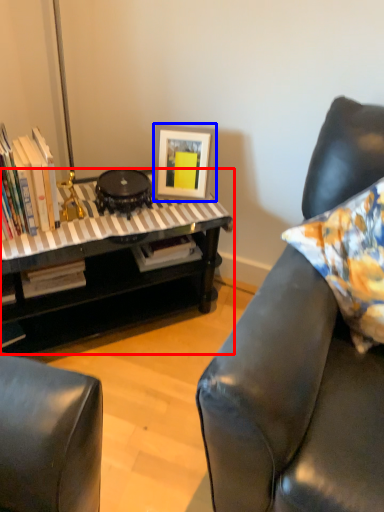
Question: Which object is further to the camera taking this photo, table (highlighted by a red box) or picture frame (highlighted by a blue box)?

Choices:
 (A) table
 (B) picture frame

Answer: (B)